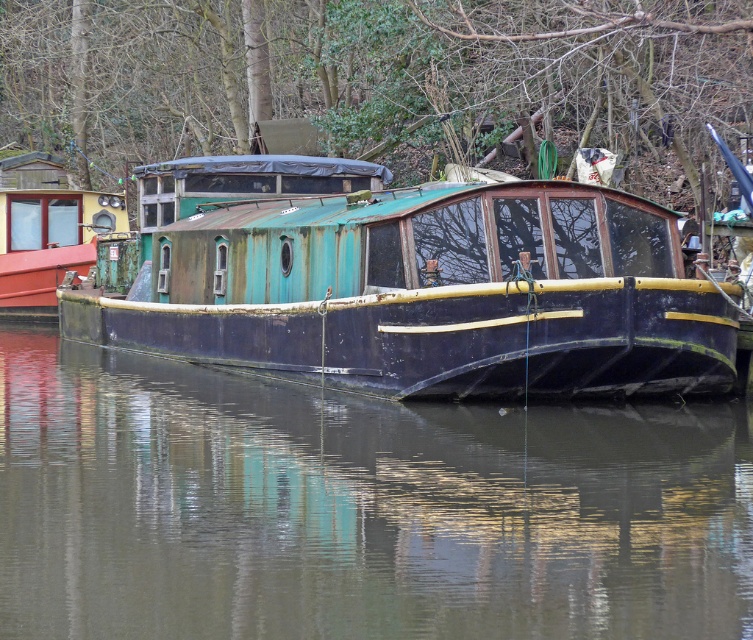
Question: Which object appears closest to the camera in this image?

Choices:
 (A) rusty metal boat at left
 (B) rusty metal boat at center

Answer: (B)

Question: Is smooth dark water at center further to the viewer compared to rusty metal boat at left?

Choices:
 (A) no
 (B) yes

Answer: (A)

Question: Which object appears closest to the camera in this image?

Choices:
 (A) rusty metal boat at left
 (B) rusty metal boat at center

Answer: (B)

Question: Is smooth dark water at center to the left of rusty metal boat at center from the viewer's perspective?

Choices:
 (A) no
 (B) yes

Answer: (A)

Question: Can you confirm if rusty metal boat at center is wider than rusty metal boat at left?

Choices:
 (A) no
 (B) yes

Answer: (B)

Question: Which object appears farthest from the camera in this image?

Choices:
 (A) rusty metal boat at center
 (B) smooth dark water at center

Answer: (A)